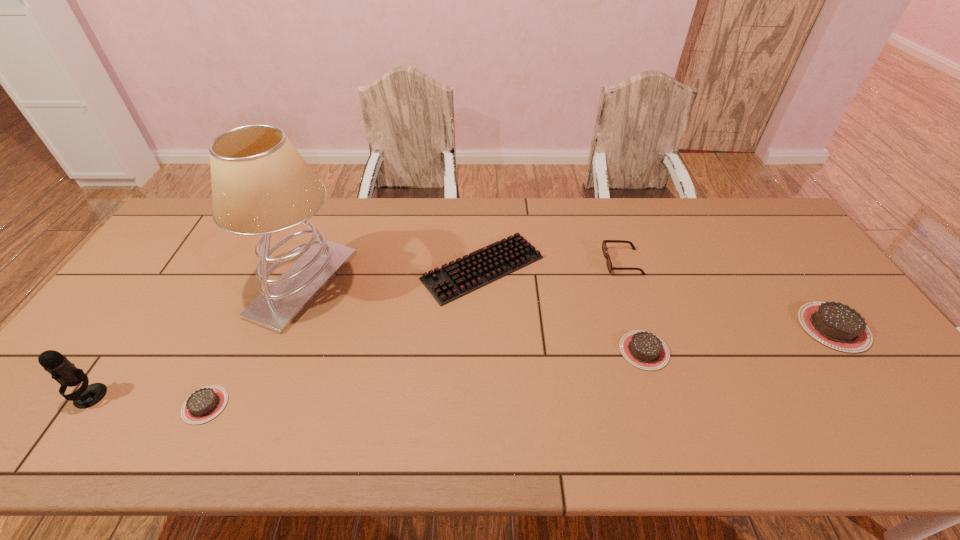
Find the location of a particular element. This screenshot has height=540, width=960. the leftmost object is located at coordinates (62, 370).

Image resolution: width=960 pixels, height=540 pixels. Identify the location of vacant point located 0.110m on the left of the shortest chocolate cake. (137, 405).

Identify the location of vacant space located 0.290m on the left of the fifth tallest object. (508, 350).

You are a GUI agent. You are given a task and a screenshot of the screen. Output one action in this format:
    pyautogui.click(x=<x>, y=<y>)
    Task: Click on the vacant space located on the front of the rightmost object
    The image size is (960, 540).
    Given the screenshot: What is the action you would take?
    [x=891, y=407]

This screenshot has height=540, width=960. Identify the location of free region located on the left of the table lamp. (214, 284).

Identify the location of blank space located 0.240m on the front-facing side of the sunglasses. (527, 262).

Find the location of a particular element. The image size is (960, 540). vacant space located on the front-facing side of the sunglasses is located at coordinates (511, 262).

The height and width of the screenshot is (540, 960). In order to click on vacant region located 0.050m on the front-facing side of the sunglasses in this screenshot , I will do `click(588, 262)`.

This screenshot has width=960, height=540. Find the location of `vacant space located on the left of the fourth object from right to left`. vacant space located on the left of the fourth object from right to left is located at coordinates (324, 268).

Where is `free space located on the right of the sixth shortest object`? free space located on the right of the sixth shortest object is located at coordinates (243, 396).